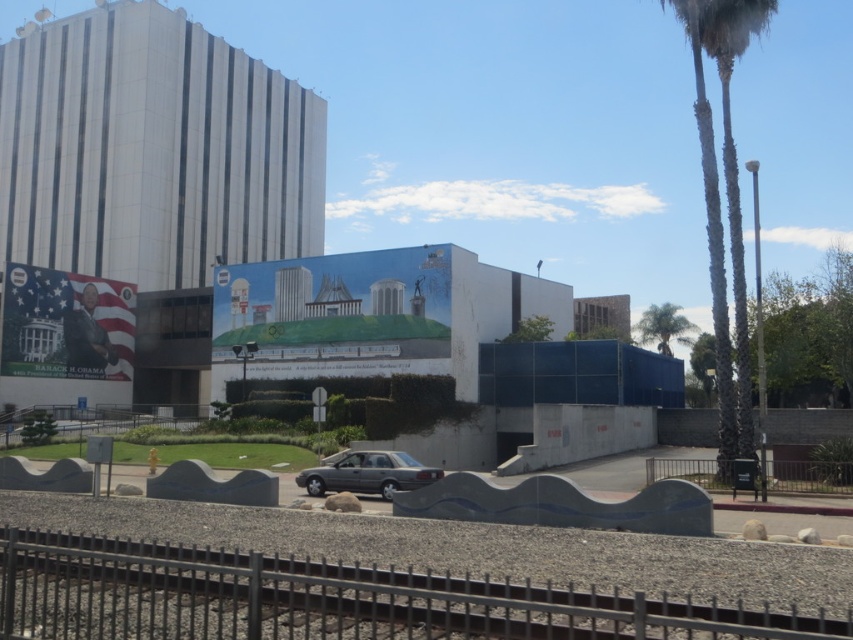
You are a delivery person trying to park your van near the metallic silver fence at lower right. The van requires a parking space that is at least 2 meters tall to accommodate its height. Based on the scene, can the green textured palm tree at right interfere with parking there?

The green textured palm tree at right is taller than the metallic silver fence at lower right. Since the van requires a parking space at least 2 meters tall and the palm tree is taller than the fence, it might interfere with the van if the tree is within the parking area. However, the exact distance between the tree and the fence isn

You are a delivery person trying to park your vehicle in this area. You see the black metal fence at lower center and the green leafy palm tree at upper right. Which object is narrower in width?

The black metal fence at lower center is thinner than the green leafy palm tree at upper right, so the black metal fence at lower center is narrower in width.

You are standing at the scene and want to walk from the metallic silver fence at lower right to the green leafy palm tree at upper right. Which direction should you move to get closer to the tree?

You should move away from the viewer since the metallic silver fence at lower right is closer to the viewer than the green leafy palm tree at upper right, meaning the tree is further back. Moving away from the viewer would take you towards the tree.